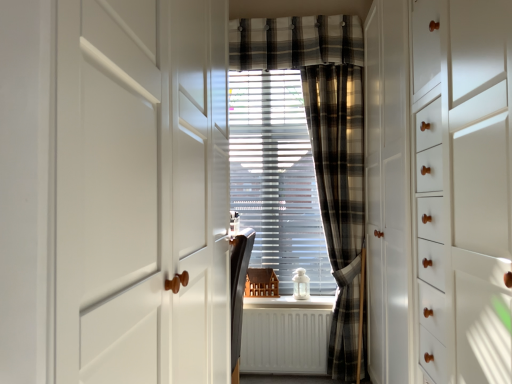
This screenshot has width=512, height=384. Find the location of `blank space above plaid fabric curtain at center (from a real-world perspective)`. blank space above plaid fabric curtain at center (from a real-world perspective) is located at coordinates (x=330, y=59).